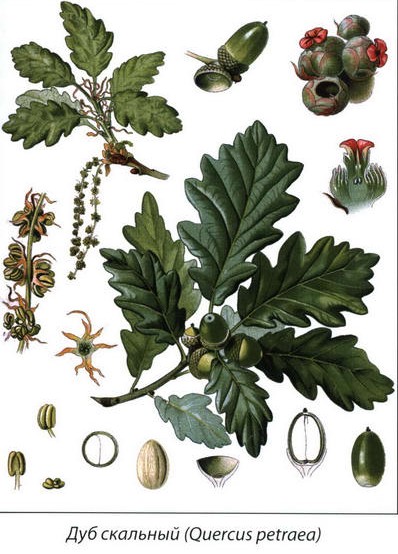
Identify the location of green plant top left. (95, 104).